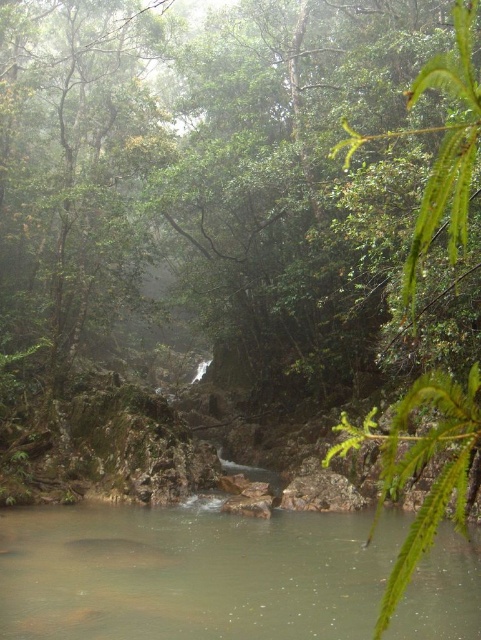
Is brown smooth river at center below green leafy tree at right?

Correct, brown smooth river at center is located below green leafy tree at right.

Is point (178, 621) less distant than point (455, 497)?

That is True.

Identify the location of brown smooth river at center. The width and height of the screenshot is (481, 640). (190, 573).